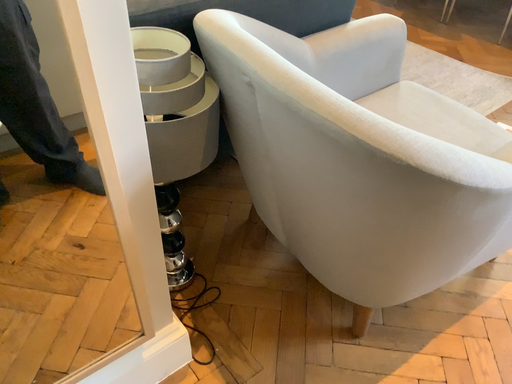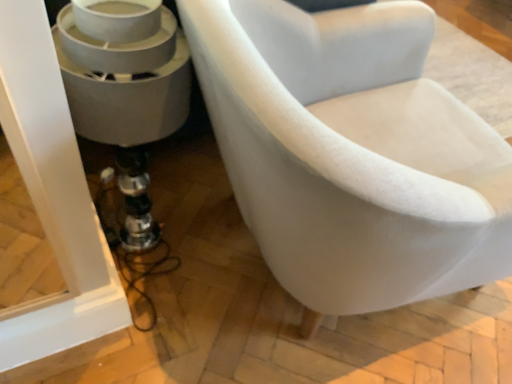
Question: How did the camera likely rotate when shooting the video?

Choices:
 (A) rotated left
 (B) rotated right

Answer: (A)